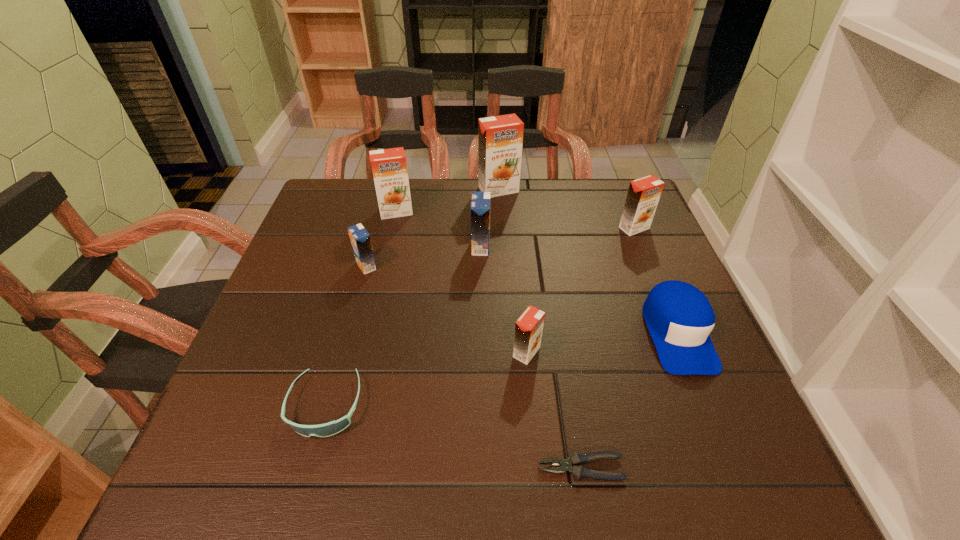
Find the location of `vacant space at the far right corner of the desktop`. vacant space at the far right corner of the desktop is located at coordinates (593, 183).

Locate an element on the screen. free area in between the fifth farthest orange juice and the goggles is located at coordinates (346, 336).

Locate an element on the screen. The height and width of the screenshot is (540, 960). blank region between the fourth nearest orange juice and the second tallest object is located at coordinates (516, 220).

Find the location of `free spot between the smaller blue orange_juice and the blue baseball cap`. free spot between the smaller blue orange_juice and the blue baseball cap is located at coordinates (522, 300).

Identify the location of empty space that is in between the left blue orange_juice and the leftmost orange orange juice. The height and width of the screenshot is (540, 960). (381, 239).

Locate an element on the screen. The width and height of the screenshot is (960, 540). blank region between the nearest orange juice and the fourth farthest object is located at coordinates (504, 299).

You are a GUI agent. You are given a task and a screenshot of the screen. Output one action in this format:
    pyautogui.click(x=<x>, y=<y>)
    Task: Click on the vacant space that's between the goggles and the farther blue orange_juice
    The width and height of the screenshot is (960, 540).
    Given the screenshot: What is the action you would take?
    pyautogui.click(x=403, y=326)

This screenshot has height=540, width=960. What are the coordinates of `vacant area that lies between the right blue orange_juice and the leftmost orange orange juice` in the screenshot? It's located at (439, 229).

The height and width of the screenshot is (540, 960). Find the location of `vacant space in between the second shortest object and the third smallest orange orange juice`. vacant space in between the second shortest object and the third smallest orange orange juice is located at coordinates (361, 309).

You are a GUI agent. You are given a task and a screenshot of the screen. Output one action in this format:
    pyautogui.click(x=<x>, y=<y>)
    Task: Click on the free space between the bigger blue orange_juice and the nearest orange orange juice
    
    Given the screenshot: What is the action you would take?
    pyautogui.click(x=504, y=299)